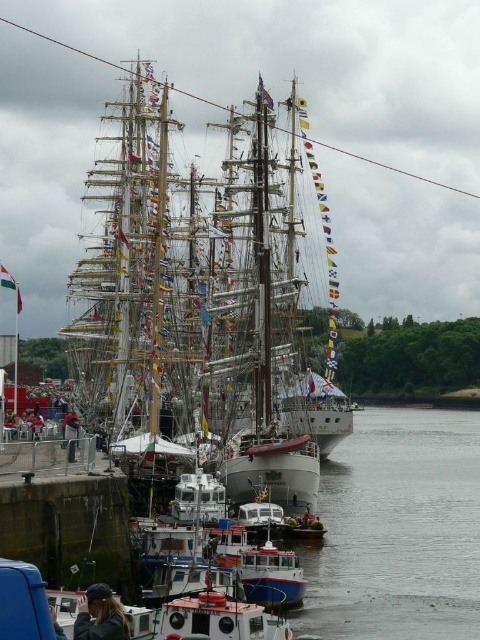
You are a photographer standing at the edge of the pier, trying to capture the two points of interest in the harbor scene. The first point is at coordinates point (79, 284) and the second is at point (84, 618). Which point will appear closer to you in your camera view?

Point (79, 284) is further to the viewer than point (84, 618), so in your camera view, the point at (79, 284) will appear closer to you.

You are standing on the pier and want to board the white wooden ship at center. To do so, you need to walk past the dark brown leather jacket at lower left. Is the jacket in your path to the ship?

The white wooden ship at center is located above the dark brown leather jacket at lower left, meaning the jacket is positioned lower down on the pier. Since the ship is above it, you would have to walk past the jacket to reach the ship.

You are a photographer standing on the pier. You want to capture a photo of the white wooden ship at center and the dark brown leather jacket at lower left in the same frame. Considering their positions, will both objects fit in your camera viewfinder if the viewfinder can only accommodate objects up to 10 meters wide?

The white wooden ship at center might be wider than dark brown leather jacket at lower left, but without exact width measurements, it is uncertain if both will fit within the 10 meters width limit of the viewfinder.